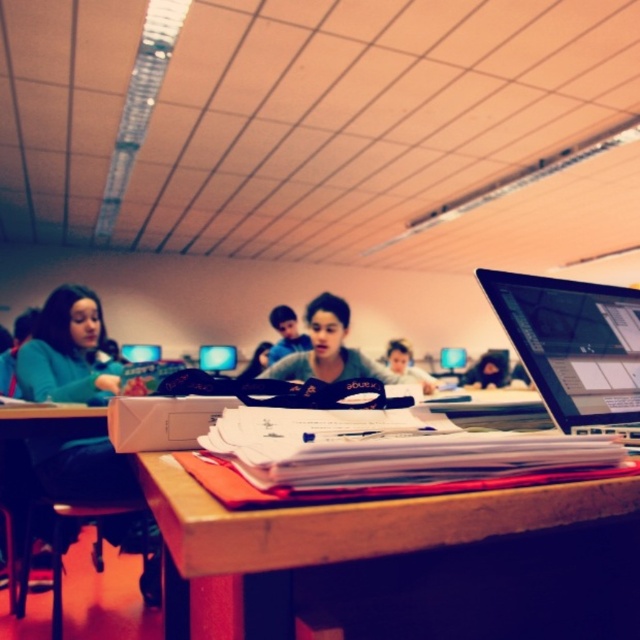
Does matte black monitor at center have a smaller size compared to matte black laptop at center?

No.

Who is positioned more to the left, matte black monitor at center or matte black laptop at center?

matte black monitor at center

Is point (225, 353) positioned before point (454, 368)?

Yes, it is.

Image resolution: width=640 pixels, height=640 pixels. Identify the location of matte black monitor at center. (218, 356).

Is matte green sweater at left above matte black laptop at center?

Correct, matte green sweater at left is located above matte black laptop at center.

Locate an element on the screen. Image resolution: width=640 pixels, height=640 pixels. matte green sweater at left is located at coordinates (67, 352).

Locate an element on the screen. Image resolution: width=640 pixels, height=640 pixels. matte green sweater at left is located at coordinates (67, 352).

This screenshot has height=640, width=640. Describe the element at coordinates (67, 352) in the screenshot. I see `matte green sweater at left` at that location.

This screenshot has height=640, width=640. I want to click on matte green sweater at left, so click(x=67, y=352).

Locate an element on the screen. matte green sweater at left is located at coordinates (67, 352).